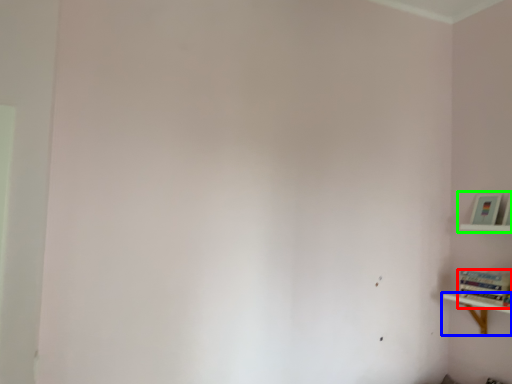
Question: Based on their relative distances, which object is nearer to book (highlighted by a red box)? Choose from shelf (highlighted by a blue box) and shelf (highlighted by a green box).

Choices:
 (A) shelf
 (B) shelf

Answer: (A)